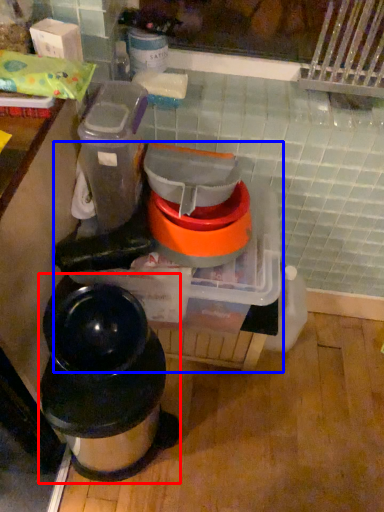
Question: Which of the following is the farthest to the observer, waste container (highlighted by a red box) or appliance (highlighted by a blue box)?

Choices:
 (A) waste container
 (B) appliance

Answer: (B)